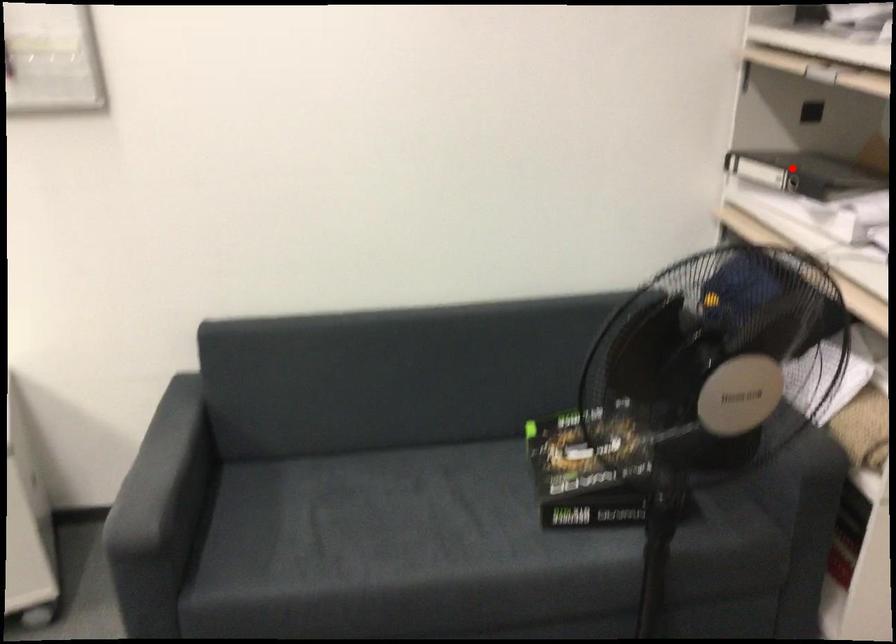
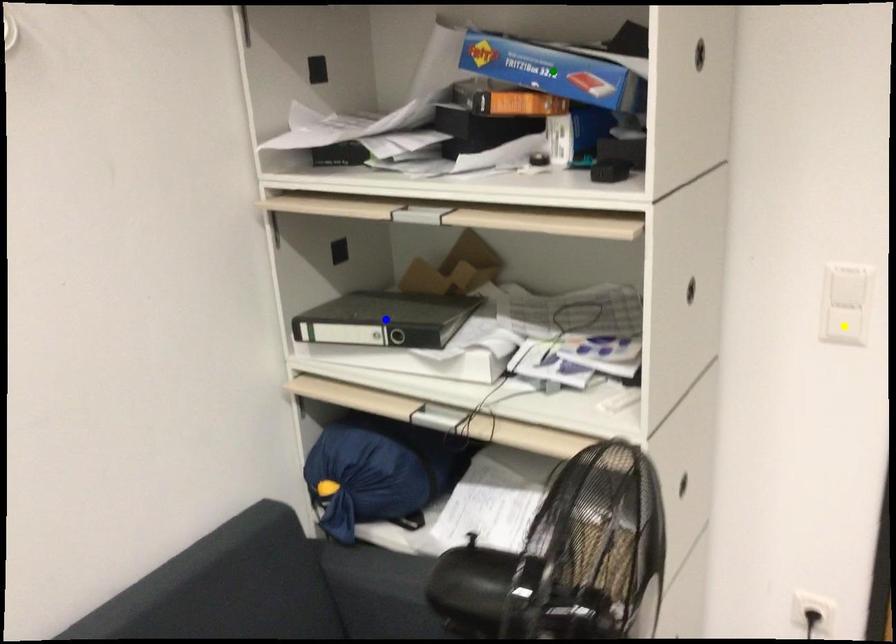
Question: I am providing you with two images of the same scene from different viewpoints. A red point is marked on the first image. You are given multiple points on the second image. Which spot in image 2 lines up with the point in image 1?

Choices:
 (A) yellow point
 (B) blue point
 (C) green point

Answer: (B)